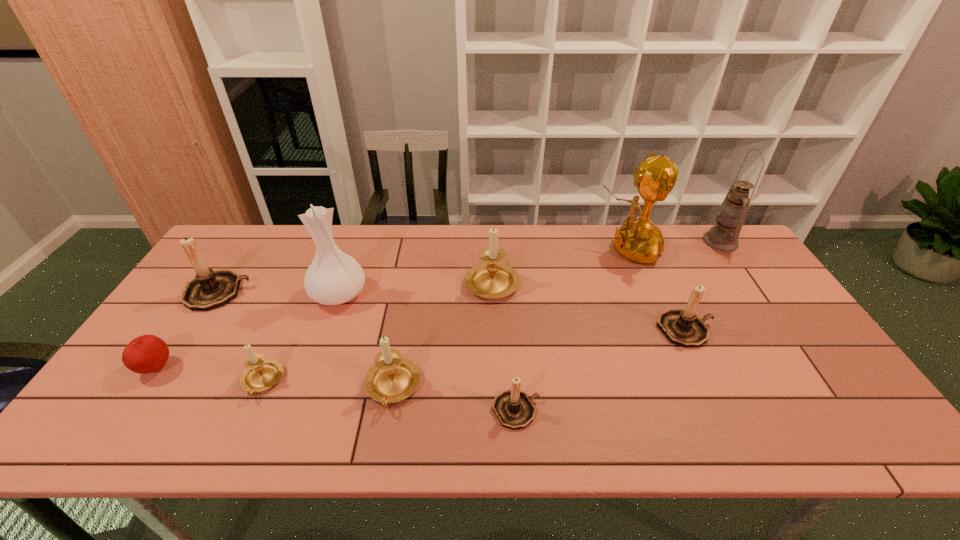
Locate an element on the screen. The width and height of the screenshot is (960, 540). free point located 0.060m on the front side of the award is located at coordinates (577, 249).

At what (x,y) coordinates should I click in order to perform the action: click on free space located on the front side of the award. Please return your answer as a coordinate pair (x, y). This screenshot has width=960, height=540. Looking at the image, I should click on (547, 249).

Locate an element on the screen. The width and height of the screenshot is (960, 540). vacant region located 0.380m on the left of the rightmost object is located at coordinates coord(593,241).

You are a GUI agent. You are given a task and a screenshot of the screen. Output one action in this format:
    pyautogui.click(x=<x>, y=<y>)
    Task: Click on the free spot located on the left of the white vase
    
    Given the screenshot: What is the action you would take?
    pyautogui.click(x=280, y=294)

This screenshot has width=960, height=540. What are the coordinates of `blank space located 0.140m with a handle on the side of the rightmost beige candle holder` in the screenshot? It's located at (491, 235).

At what (x,y) coordinates should I click in order to perform the action: click on free space located with a handle on the side of the rightmost beige candle holder. Please return your answer as a coordinate pair (x, y). The height and width of the screenshot is (540, 960). Looking at the image, I should click on (491, 242).

Find the location of `free space located 0.100m with a handle on the side of the rightmost beige candle holder`. free space located 0.100m with a handle on the side of the rightmost beige candle holder is located at coordinates (491, 242).

Where is `vacant space situated on the front of the leftmost candle holder`? This screenshot has height=540, width=960. vacant space situated on the front of the leftmost candle holder is located at coordinates (191, 333).

This screenshot has height=540, width=960. I want to click on vacant space located on the front of the rightmost brown candle holder, so click(708, 377).

Locate an element on the screen. The image size is (960, 540). vacant area located with a handle on the side of the second beige candle holder from right to left is located at coordinates (383, 442).